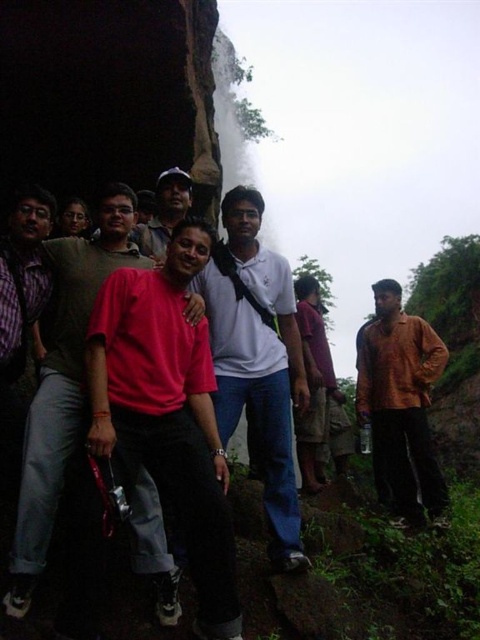
Can you confirm if matte red shirt at center is positioned above matte white shirt at center?

Actually, matte red shirt at center is below matte white shirt at center.

Which of these two, matte red shirt at center or matte white shirt at center, stands taller?

matte red shirt at center

Locate an element on the screen. matte red shirt at center is located at coordinates (63, 385).

Where is `matte red shirt at center`? The image size is (480, 640). matte red shirt at center is located at coordinates (63, 385).

Who is higher up, bright red t-shirt at center or matte white shirt at center?

matte white shirt at center is higher up.

Can you confirm if bright red t-shirt at center is wider than matte white shirt at center?

Yes, bright red t-shirt at center is wider than matte white shirt at center.

Identify the location of bright red t-shirt at center. Image resolution: width=480 pixels, height=640 pixels. (167, 412).

Between purple cotton shirt at center and matte white shirt at center, which one has more height?

With more height is purple cotton shirt at center.

Which is more to the left, purple cotton shirt at center or matte white shirt at center?

From the viewer's perspective, matte white shirt at center appears more on the left side.

The width and height of the screenshot is (480, 640). I want to click on purple cotton shirt at center, so click(313, 385).

Locate an element on the screen. The width and height of the screenshot is (480, 640). purple cotton shirt at center is located at coordinates (313, 385).